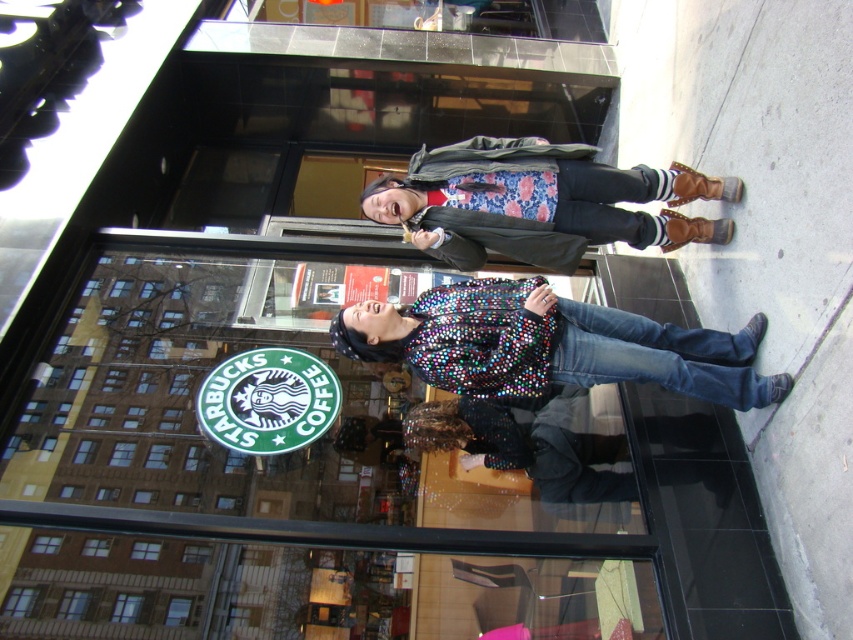
Does shiny sequined jacket at center have a larger size compared to floral fabric shirt at center?

Incorrect, shiny sequined jacket at center is not larger than floral fabric shirt at center.

Between point (461, 336) and point (668, 189), which one is positioned behind?

Point (668, 189)

Which is behind, point (746, 368) or point (729, 224)?

The point (729, 224) is behind.

This screenshot has width=853, height=640. I want to click on shiny sequined jacket at center, so click(x=550, y=344).